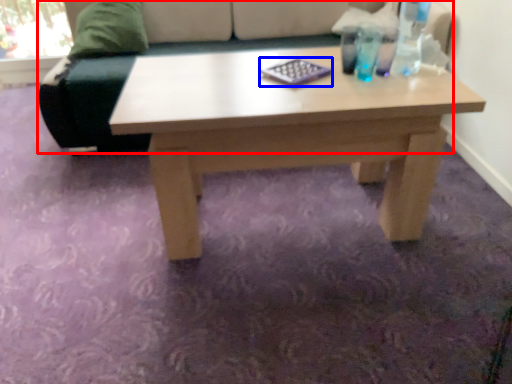
Question: Which object appears closest to the camera in this image, studio couch (highlighted by a red box) or pad (highlighted by a blue box)?

Choices:
 (A) studio couch
 (B) pad

Answer: (B)